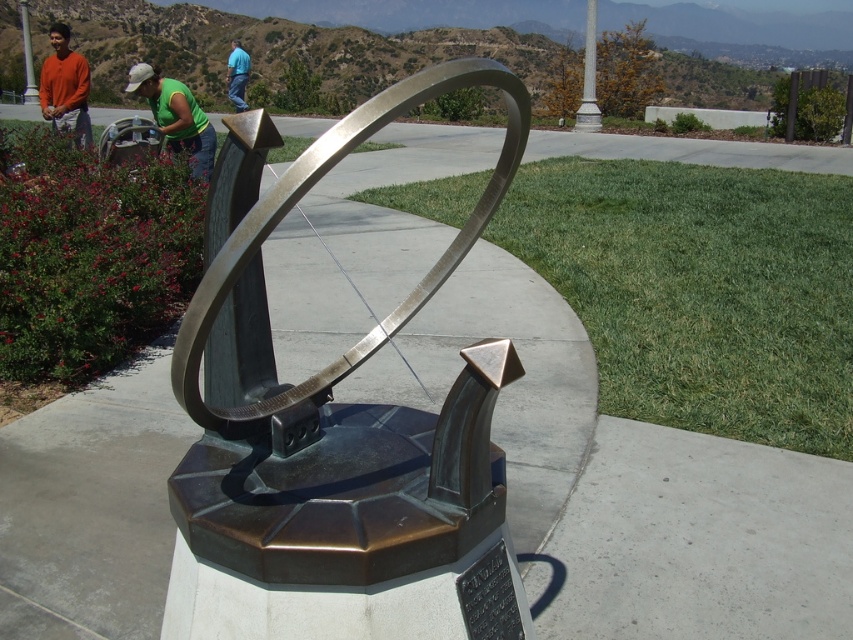
Question: Which object is positioned closest to the orange shirt at left?

Choices:
 (A) green fabric shirt at upper left
 (B) polished bronze sundial at center
 (C) blue shirt at upper center

Answer: (A)

Question: Does polished bronze sundial at center have a smaller size compared to blue shirt at upper center?

Choices:
 (A) yes
 (B) no

Answer: (A)

Question: Which is nearer to the polished bronze sundial at center?

Choices:
 (A) green fabric shirt at upper left
 (B) orange shirt at left
 (C) blue shirt at upper center

Answer: (A)

Question: Is polished bronze sundial at center below blue shirt at upper center?

Choices:
 (A) yes
 (B) no

Answer: (A)

Question: In this image, where is green fabric shirt at upper left located relative to blue shirt at upper center?

Choices:
 (A) above
 (B) below

Answer: (B)

Question: Considering the real-world distances, which object is farthest from the green fabric shirt at upper left?

Choices:
 (A) polished bronze sundial at center
 (B) blue shirt at upper center

Answer: (B)